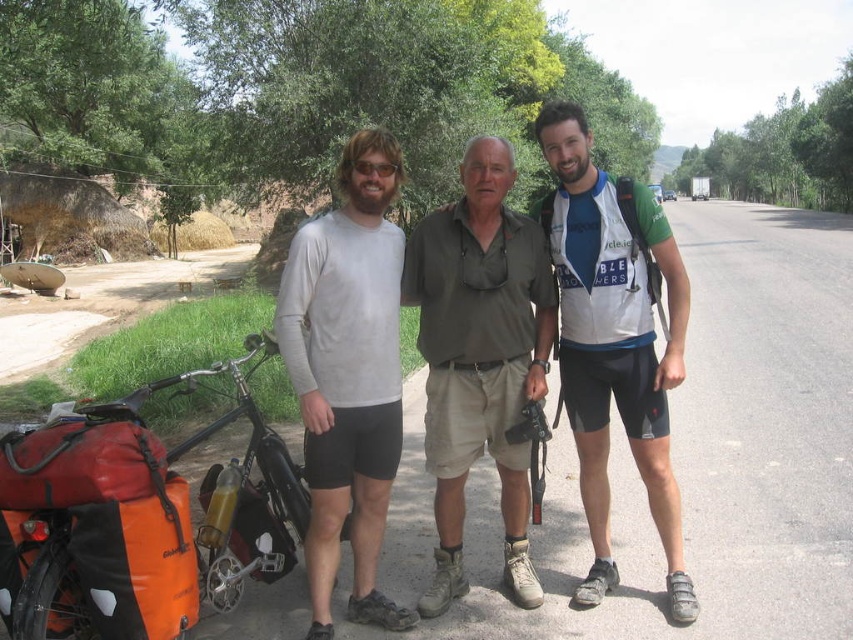
Question: Is matte white shirt at center above khaki cotton shirt at center?

Choices:
 (A) yes
 (B) no

Answer: (A)

Question: Which point is farther from the camera taking this photo?

Choices:
 (A) (450, 388)
 (B) (368, 436)
 (C) (73, 634)
 (D) (619, 404)

Answer: (D)

Question: Estimate the real-world distances between objects in this image. Which object is farther from the khaki cotton shirt at center?

Choices:
 (A) white long-sleeved shirt at center
 (B) orange fabric motorcycle at lower left

Answer: (B)

Question: Can you confirm if matte white shirt at center is positioned above khaki cotton shirt at center?

Choices:
 (A) yes
 (B) no

Answer: (A)

Question: Which object is farther from the camera taking this photo?

Choices:
 (A) matte white shirt at center
 (B) orange fabric motorcycle at lower left
 (C) white mesh shirt at center

Answer: (C)

Question: Is orange fabric motorcycle at lower left to the left of white mesh shirt at center from the viewer's perspective?

Choices:
 (A) yes
 (B) no

Answer: (A)